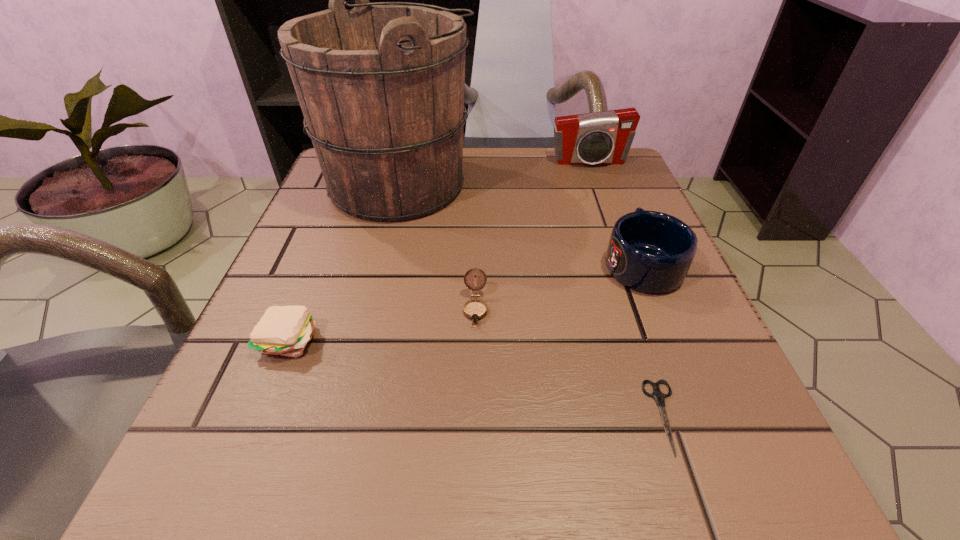
Where is `the tallest object`? The image size is (960, 540). the tallest object is located at coordinates (381, 86).

The width and height of the screenshot is (960, 540). Find the location of `the fifth shortest object`. the fifth shortest object is located at coordinates (601, 138).

Locate an element on the screen. The width and height of the screenshot is (960, 540). the fourth shortest object is located at coordinates (651, 252).

At what (x,y) coordinates should I click in order to perform the action: click on compass. Please return your answer as a coordinate pair (x, y). Looking at the image, I should click on (475, 309).

The height and width of the screenshot is (540, 960). I want to click on patty, so click(x=283, y=330).

The height and width of the screenshot is (540, 960). I want to click on shears, so [x=659, y=397].

I want to click on the shortest object, so click(659, 397).

At what (x,y) coordinates should I click in order to perform the action: click on vacant area situated on the front of the tallest object. Please return your answer as a coordinate pair (x, y). Looking at the image, I should click on (377, 269).

You are a GUI agent. You are given a task and a screenshot of the screen. Output one action in this format:
    pyautogui.click(x=<x>, y=<y>)
    Task: Click on the vacant space situated 0.070m on the front-facing side of the fifth shortest object
    
    Given the screenshot: What is the action you would take?
    pyautogui.click(x=598, y=186)

Where is `vacant space located 0.290m with the handle on the side of the fourth shortest object`? The height and width of the screenshot is (540, 960). vacant space located 0.290m with the handle on the side of the fourth shortest object is located at coordinates (599, 159).